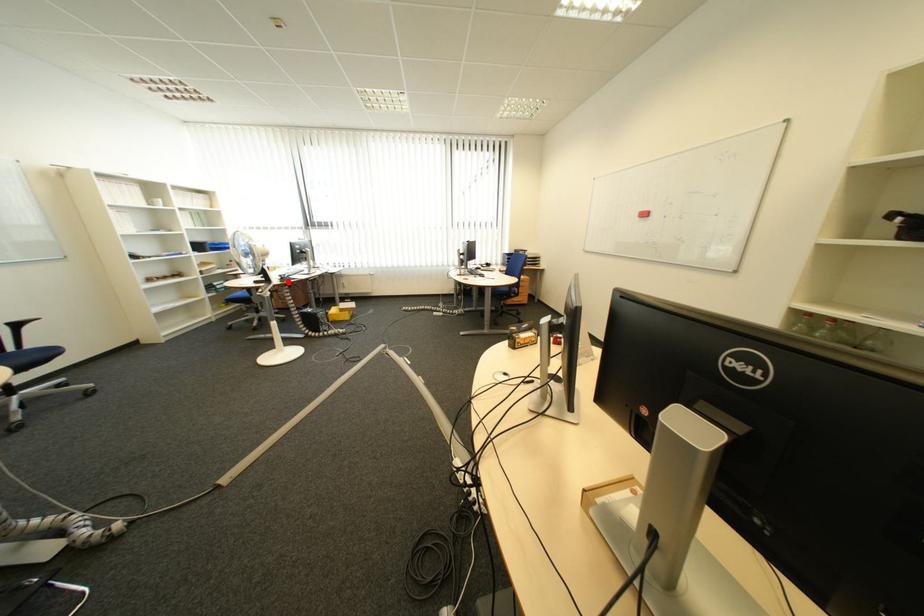
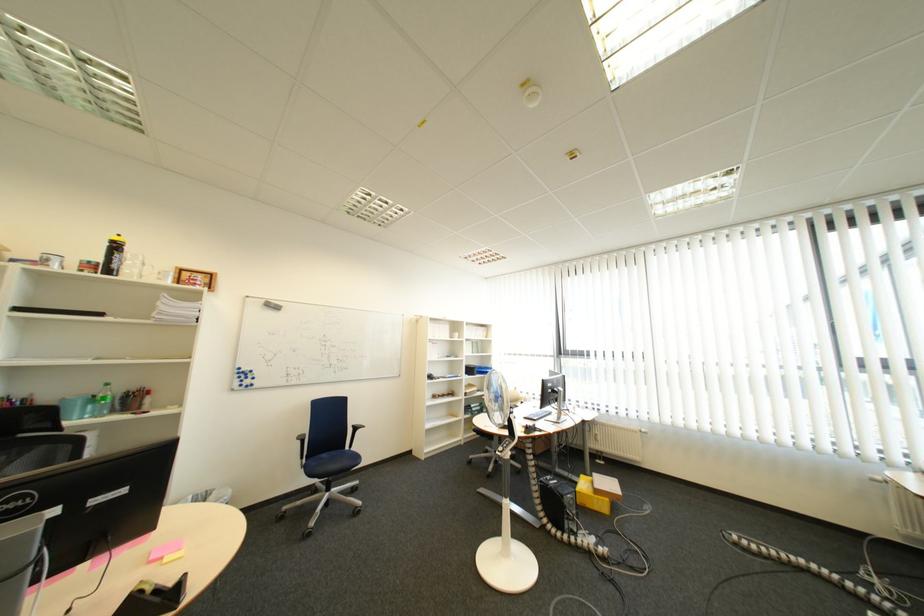
Locate, in the second image, the point that corresponds to the highlighted location in the first image.

(532, 432)